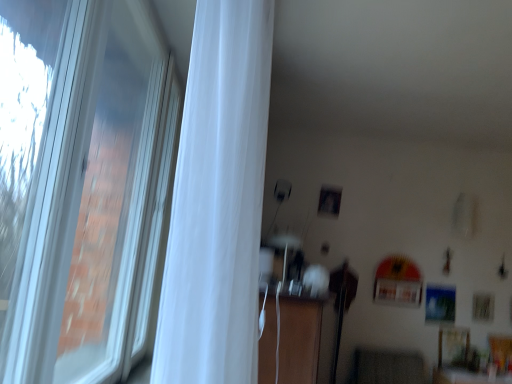
Image resolution: width=512 pixels, height=384 pixels. What do you see at coordinates (217, 201) in the screenshot? I see `white sheer curtain at left` at bounding box center [217, 201].

Describe the element at coordinates (81, 185) in the screenshot. The height and width of the screenshot is (384, 512). I see `white plastic window at left` at that location.

Image resolution: width=512 pixels, height=384 pixels. What are the coordinates of `white sheer curtain at left` in the screenshot? It's located at (217, 201).

Based on the photo, choose the correct answer: Is white sheer curtain at left inside white plastic window at left or outside it?

white sheer curtain at left is spatially situated outside white plastic window at left.

Consider the image. How distant is white sheer curtain at left from white plastic window at left?

white sheer curtain at left and white plastic window at left are 1.31 meters apart.

Can you confirm if white sheer curtain at left is bigger than white plastic window at left?

Actually, white sheer curtain at left might be smaller than white plastic window at left.

Which is more to the left, white sheer curtain at left or white plastic window at left?

Positioned to the left is white plastic window at left.

Considering the sizes of objects white sheer curtain at left and wooden dresser at center in the image provided, who is thinner, white sheer curtain at left or wooden dresser at center?

Thinner between the two is white sheer curtain at left.

Is white sheer curtain at left not close to wooden dresser at center?

Yes, white sheer curtain at left is far from wooden dresser at center.

Between point (233, 228) and point (309, 329), which one is positioned in front?

Positioned in front is point (233, 228).

Between white plastic window at left and wooden dresser at center, which one has smaller size?

With smaller size is white plastic window at left.

Which is correct: white plastic window at left is inside wooden dresser at center, or outside of it?

white plastic window at left is spatially situated outside wooden dresser at center.

Can you tell me how much white plastic window at left and wooden dresser at center differ in facing direction?

The facing directions of white plastic window at left and wooden dresser at center are 1.17 degrees apart.

Can you confirm if white plastic window at left is taller than wooden dresser at center?

Correct, white plastic window at left is much taller as wooden dresser at center.

Could you tell me if wooden dresser at center is turned towards white plastic window at left?

No, wooden dresser at center does not turn towards white plastic window at left.

Is wooden dresser at center not close to white plastic window at left?

No, there isn't a large distance between wooden dresser at center and white plastic window at left.

Does point (287, 354) lie behind point (89, 142)?

Yes, it is.

How many degrees apart are the facing directions of wooden dresser at center and white plastic window at left?

The angle between the facing direction of wooden dresser at center and the facing direction of white plastic window at left is 1.17 degrees.

From a real-world perspective, which is physically above, white plastic window at left or white sheer curtain at left?

white sheer curtain at left is physically above.

Is white plastic window at left aimed at white sheer curtain at left?

Yes, white plastic window at left is aimed at white sheer curtain at left.

Could white sheer curtain at left be considered to be inside white plastic window at left?

No.

From the image's perspective, is white plastic window at left under white sheer curtain at left?

Yes.

Where is `dresser that is on the right side of white sheer curtain at left`? dresser that is on the right side of white sheer curtain at left is located at coordinates (298, 339).

Is wooden dresser at center smaller than white sheer curtain at left?

Incorrect, wooden dresser at center is not smaller in size than white sheer curtain at left.

From the image's perspective, which one is positioned lower, wooden dresser at center or white sheer curtain at left?

wooden dresser at center is shown below in the image.

Between point (308, 353) and point (250, 211), which one is positioned in front?

Positioned in front is point (250, 211).

Where is `curtain behind the white plastic window at left`? Image resolution: width=512 pixels, height=384 pixels. curtain behind the white plastic window at left is located at coordinates (217, 201).

At what (x,y) coordinates should I click in order to perform the action: click on curtain above the wooden dresser at center (from a real-world perspective). Please return your answer as a coordinate pair (x, y). Image resolution: width=512 pixels, height=384 pixels. Looking at the image, I should click on (217, 201).

Considering their positions, is wooden dresser at center positioned further to white sheer curtain at left than white plastic window at left?

wooden dresser at center is further to white sheer curtain at left.

Considering their positions, is white sheer curtain at left positioned closer to wooden dresser at center than white plastic window at left?

white plastic window at left is closer to wooden dresser at center.

Considering their positions, is white plastic window at left positioned closer to wooden dresser at center than white sheer curtain at left?

white plastic window at left lies closer to wooden dresser at center than the other object.

Considering their positions, is white plastic window at left positioned further to white sheer curtain at left than wooden dresser at center?

Based on the image, wooden dresser at center appears to be further to white sheer curtain at left.

Which object lies further to the anchor point white plastic window at left, white sheer curtain at left or wooden dresser at center?

Among the two, white sheer curtain at left is located further to white plastic window at left.

Estimate the real-world distances between objects in this image. Which object is further from white plastic window at left, wooden dresser at center or white sheer curtain at left?

Based on the image, white sheer curtain at left appears to be further to white plastic window at left.

This screenshot has width=512, height=384. I want to click on curtain positioned between white plastic window at left and wooden dresser at center from near to far, so click(217, 201).